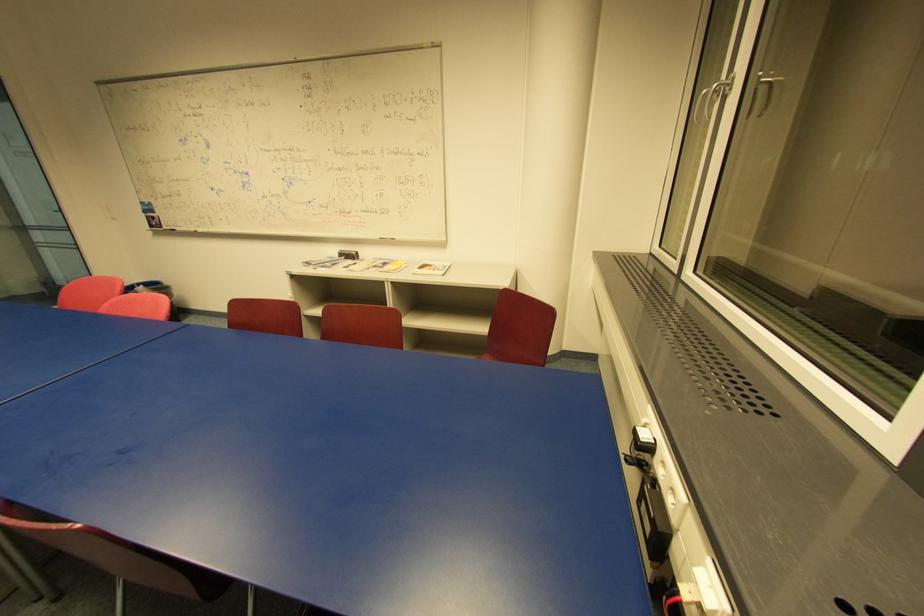
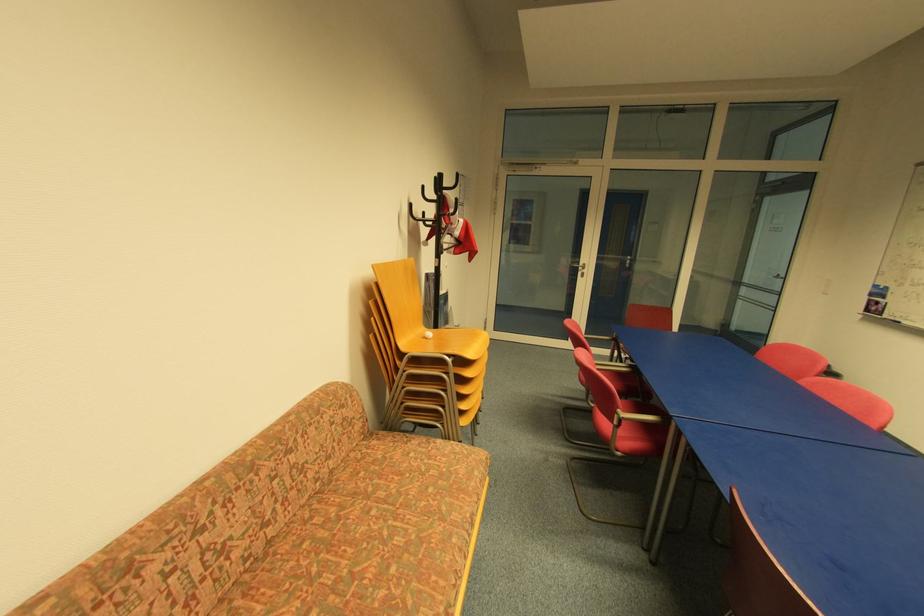
Question: Based on the continuous images, in which direction is the camera rotating? Reply with the corresponding letter.

Choices:
 (A) Left
 (B) Right
 (C) Up
 (D) Down

Answer: (A)